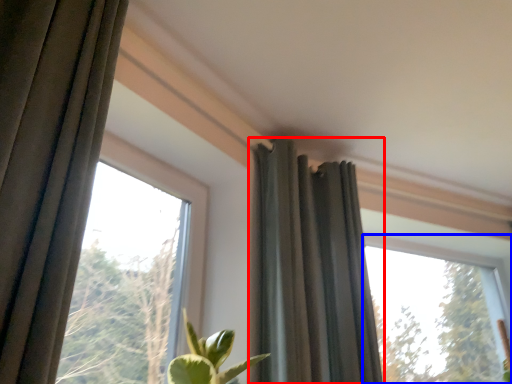
Question: Which point is further to the camera, curtain (highlighted by a red box) or window (highlighted by a blue box)?

Choices:
 (A) curtain
 (B) window

Answer: (B)